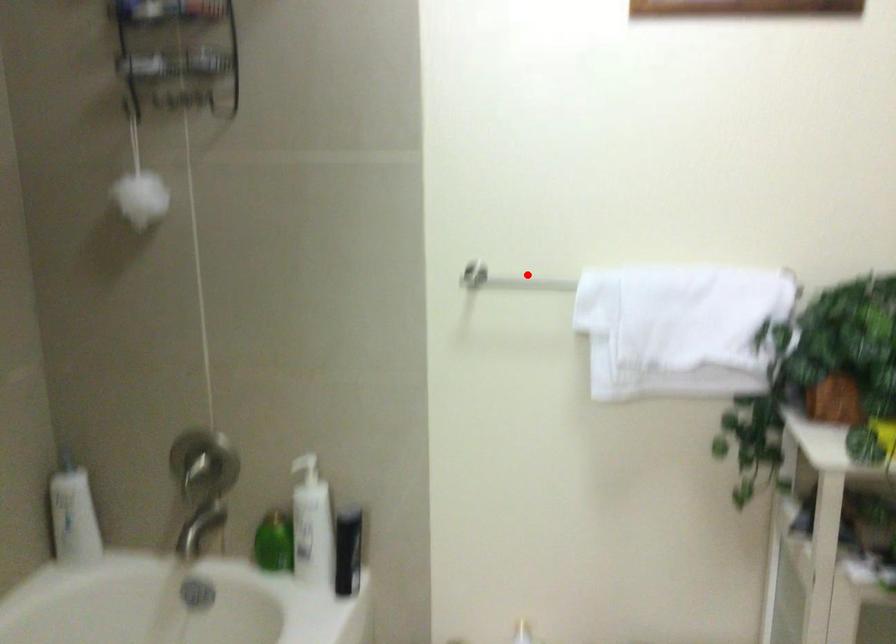
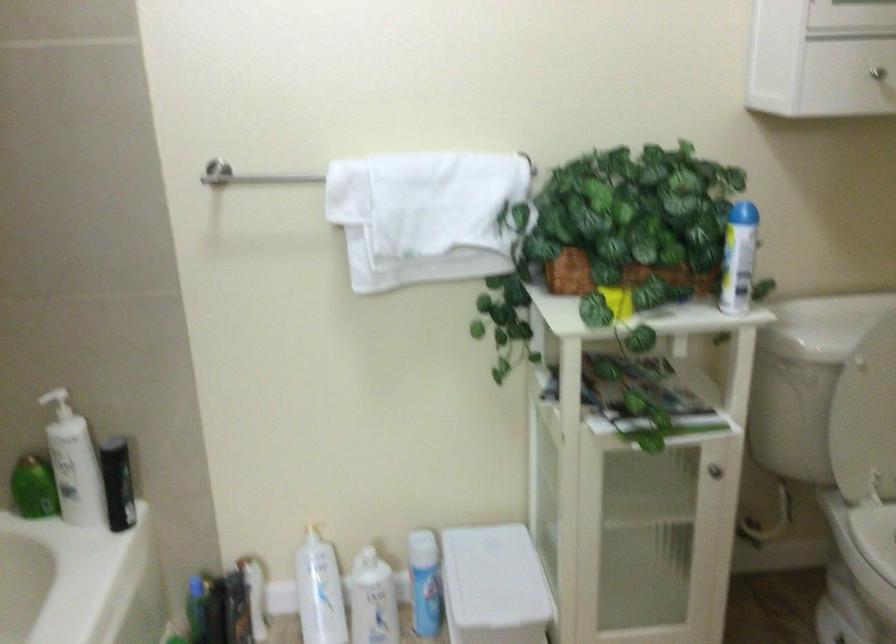
In the second image, find the point that corresponds to the highlighted location in the first image.

(278, 176)